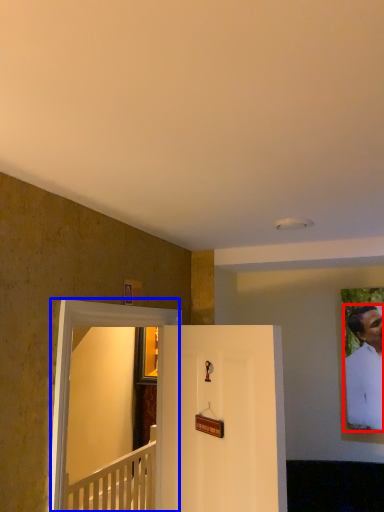
Question: Which of the following is the closest to the observer, man (highlighted by a red box) or glass door (highlighted by a blue box)?

Choices:
 (A) man
 (B) glass door

Answer: (B)